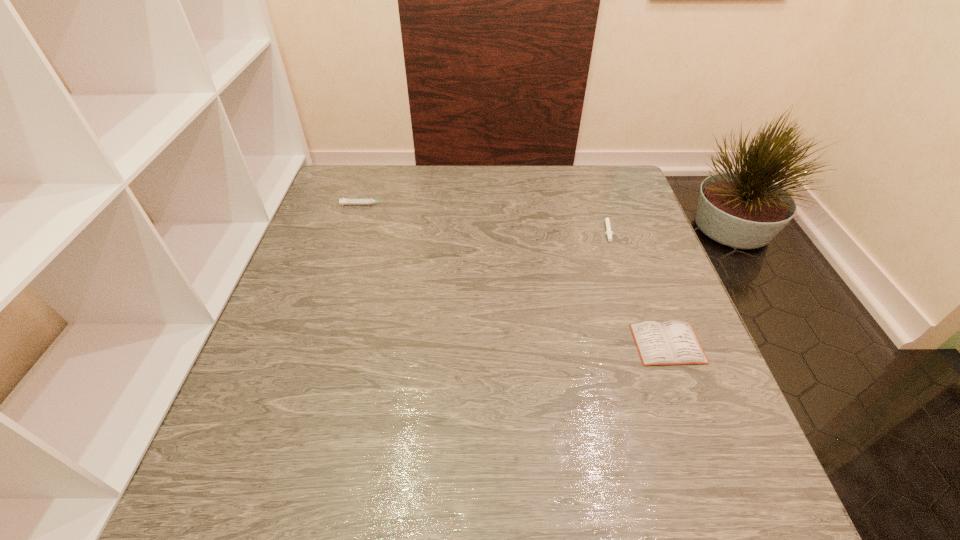
Locate an element on the screen. Image resolution: width=960 pixels, height=540 pixels. empty location between the nearest object and the nearer syringe is located at coordinates (637, 286).

Locate an element on the screen. The image size is (960, 540). empty space between the left syringe and the diary is located at coordinates (516, 274).

The height and width of the screenshot is (540, 960). I want to click on vacant area that lies between the nearer syringe and the taller syringe, so click(486, 216).

Identify the location of free area in between the nearer syringe and the tallest object. The width and height of the screenshot is (960, 540). (486, 216).

Locate an element on the screen. This screenshot has height=540, width=960. empty space between the shorter syringe and the nearest object is located at coordinates (637, 286).

The width and height of the screenshot is (960, 540). Find the location of `free space between the nearest object and the leftmost object`. free space between the nearest object and the leftmost object is located at coordinates 516,274.

The width and height of the screenshot is (960, 540). Identify the location of free spot between the second farthest object and the nearest object. (637, 286).

Find the location of `vacant space that is in between the diary and the second nearest object`. vacant space that is in between the diary and the second nearest object is located at coordinates (637, 286).

Image resolution: width=960 pixels, height=540 pixels. Find the location of `vacant point located between the diary and the second farthest object`. vacant point located between the diary and the second farthest object is located at coordinates (637, 286).

You are a GUI agent. You are given a task and a screenshot of the screen. Output one action in this format:
    pyautogui.click(x=<x>, y=<y>)
    Task: Click on the object that can be found as the second closest to the farthest object
    
    Given the screenshot: What is the action you would take?
    pyautogui.click(x=672, y=342)